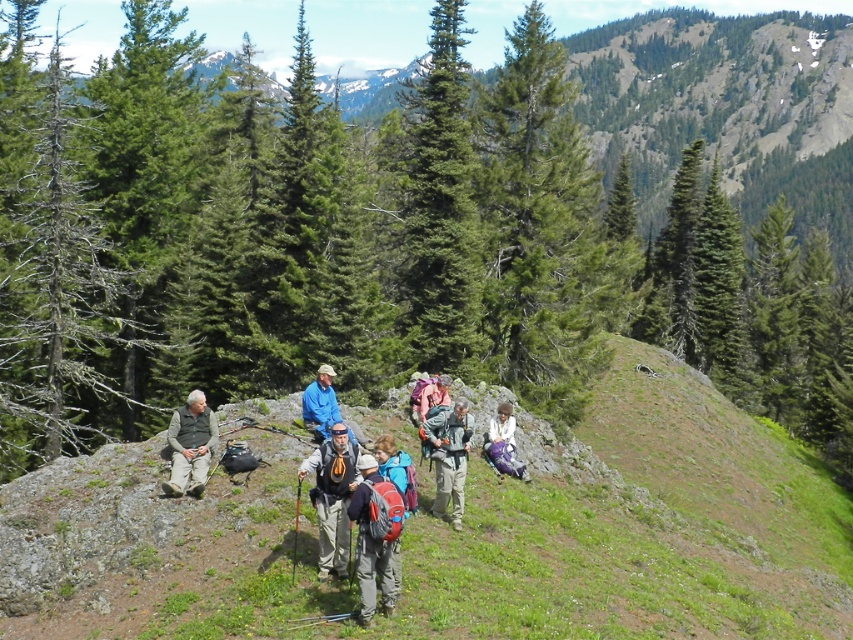
You are a hiker who needs to locate your matte blue backpack at center. Based on the scene description, where would you expect to find it?

The matte blue backpack at center is located at the point with coordinates 0.838 on the x axis and 0.440 on the y axis.

You are a hiker planning to store your green fabric jacket at left and matte blue backpack at center. Based on their sizes, which item should you place first in your storage area to maximize space efficiency?

The matte blue backpack at center is much taller than the green fabric jacket at left, so you should place the taller matte blue backpack at center first to optimize vertical space and ensure the smaller jacket fits underneath or beside it efficiently.